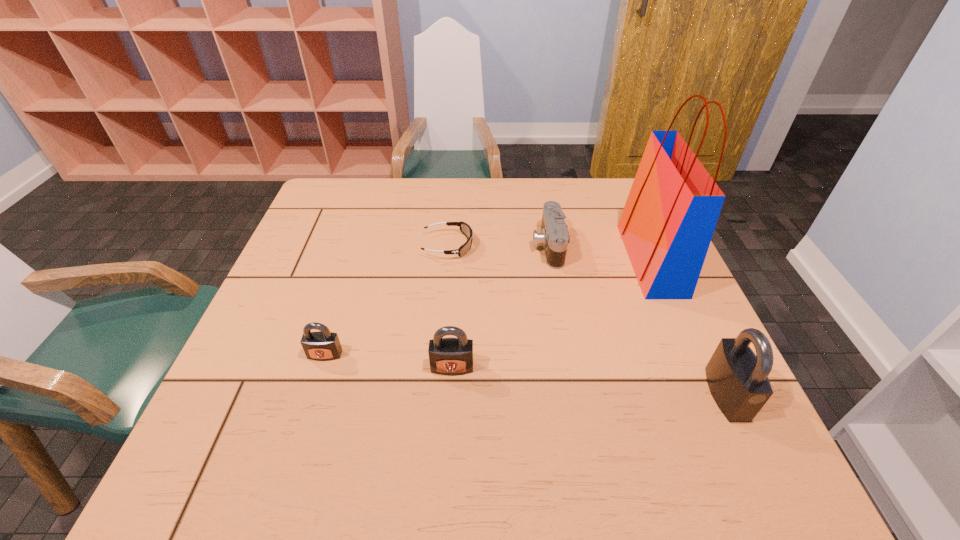
This screenshot has width=960, height=540. What are the coordinates of `empty location between the leftmost object and the shopping bag` in the screenshot? It's located at [x=488, y=307].

Locate an element on the screen. vacant space in between the tallest padlock and the leftmost padlock is located at coordinates (526, 374).

Identify the location of free space between the shortest object and the rightmost padlock. Image resolution: width=960 pixels, height=540 pixels. (588, 320).

Image resolution: width=960 pixels, height=540 pixels. I want to click on empty space between the tallest padlock and the leftmost object, so click(x=526, y=374).

I want to click on vacant area between the shopping bag and the leftmost object, so click(488, 307).

You are a GUI agent. You are given a task and a screenshot of the screen. Output one action in this format:
    pyautogui.click(x=<x>, y=<y>)
    Task: Click on the vacant region between the camera and the leftmost padlock
    The image size is (960, 540).
    Given the screenshot: What is the action you would take?
    (x=437, y=300)

Select which object appears as the fourth closest to the leftmost object. Please provide its 2D coordinates. Your answer should be formatted as a tuple, i.e. [(x, y)], where the tuple contains the x and y coordinates of a point satisfying the conditions above.

[(672, 209)]

I want to click on object that stands as the closest to the tallest object, so click(x=554, y=237).

Identify which padlock is located as the third nearest to the shopping bag. Please provide its 2D coordinates. Your answer should be formatted as a tuple, i.e. [(x, y)], where the tuple contains the x and y coordinates of a point satisfying the conditions above.

[(323, 345)]

Select which padlock appears as the closest to the second tallest padlock. Please provide its 2D coordinates. Your answer should be formatted as a tuple, i.e. [(x, y)], where the tuple contains the x and y coordinates of a point satisfying the conditions above.

[(323, 345)]